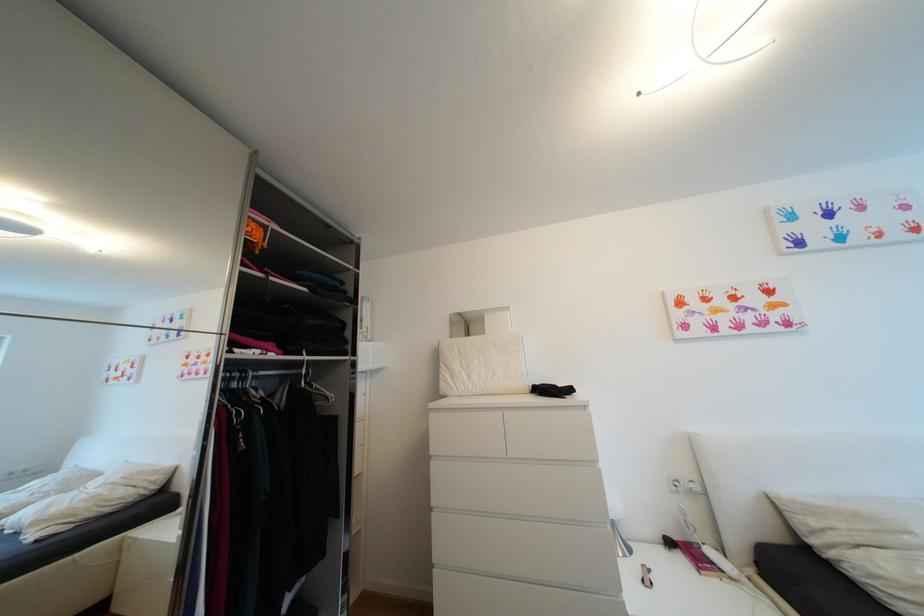
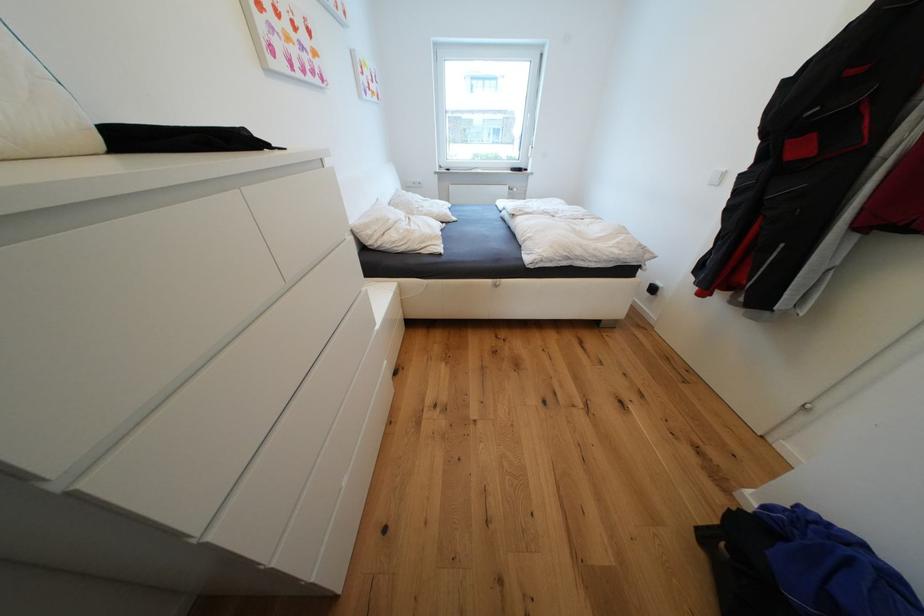
Find the pixel in the second image that matches point (821, 524) in the first image.

(377, 233)